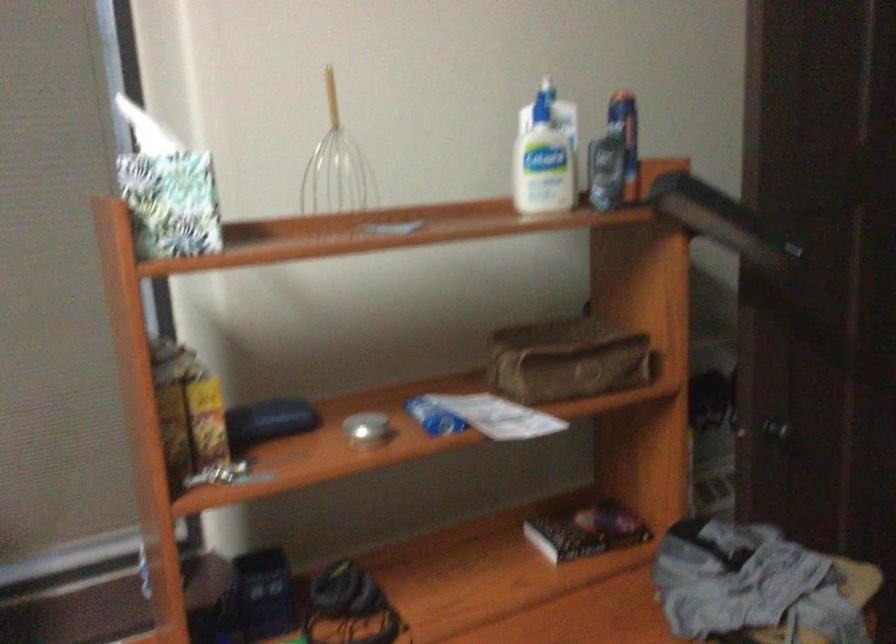
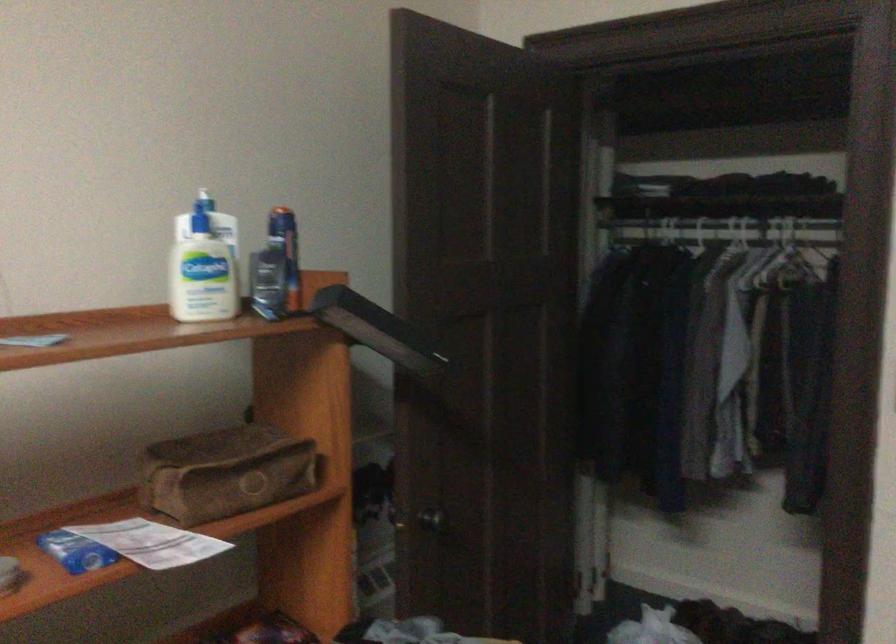
Where in the second image is the point corresponding to (x=718, y=395) from the first image?

(373, 491)